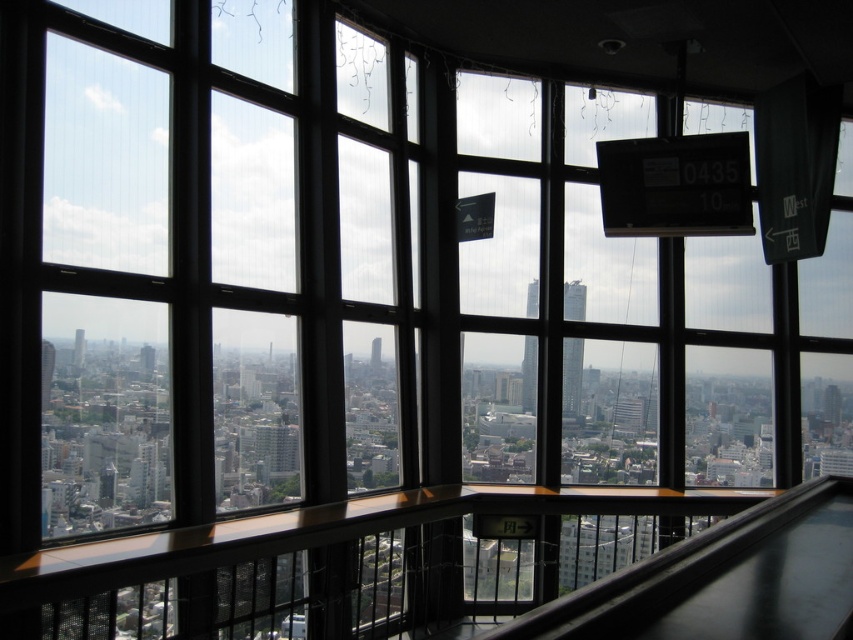
You are standing inside a building with large windows overlooking a city. You notice a point marked at coordinates (x=572, y=376) on the window. What does this point likely indicate?

The point at coordinates (x=572, y=376) corresponds to the smooth glass tower at center, indicating its location within the window frame.